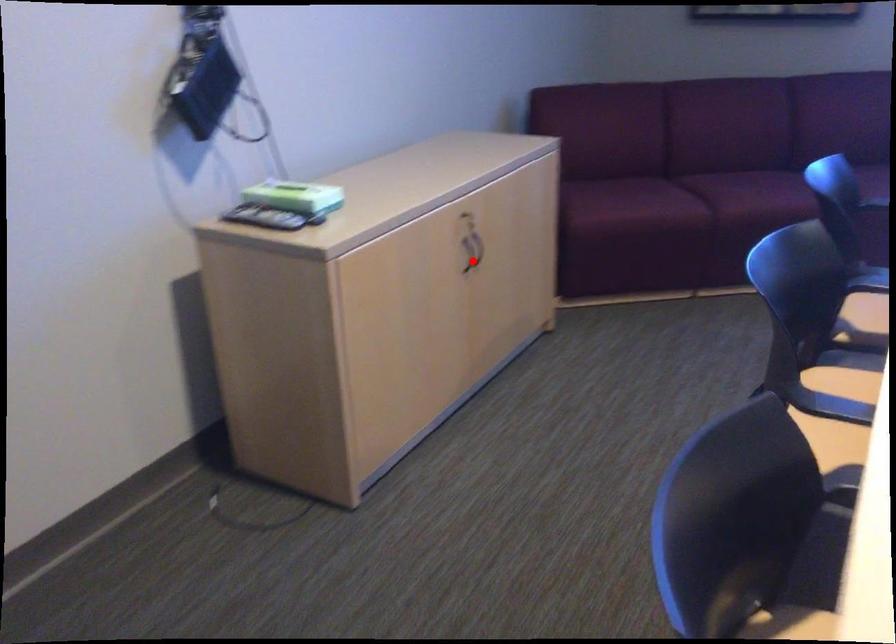
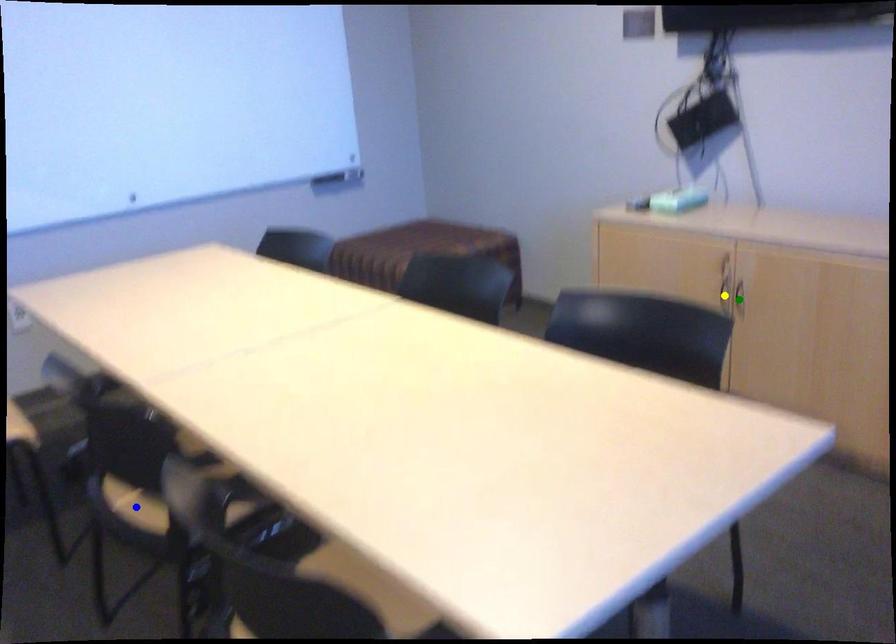
Question: I am providing you with two images of the same scene from different viewpoints. A red point is marked on the first image. You are given multiple points on the second image. Which spot in image 2 lines up with the point in image 1?

Choices:
 (A) blue point
 (B) yellow point
 (C) green point

Answer: (C)